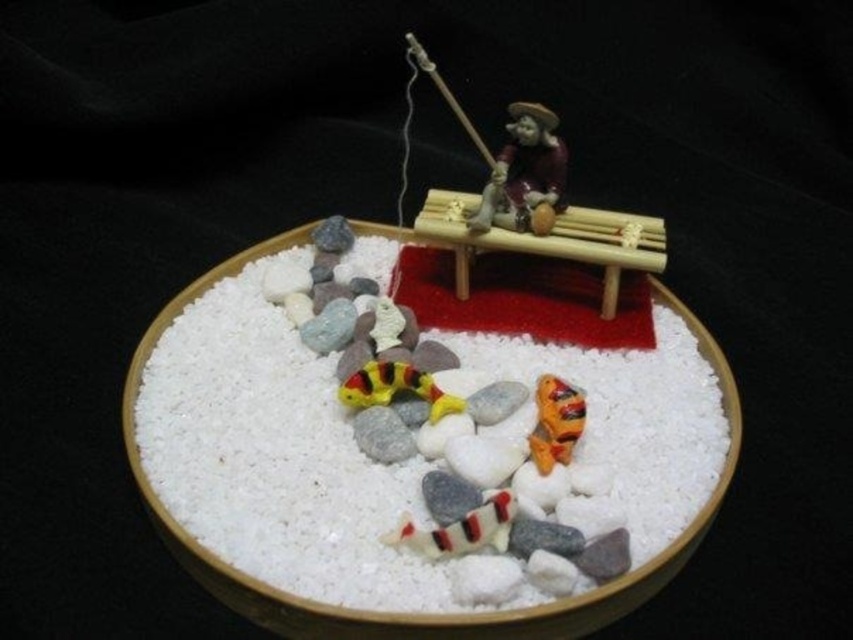
You are a tiny explorer standing at the edge of the circular container. You see the white sand at center located at point (267, 456). If you want to reach the white sand at center, which direction should you move from your current position?

Since the white sand at center is located at point (267, 456), you should move towards the center of the circular container to reach it.

You are an architect designing a scale model of a fishing village. In your model, you have a matte brown figurine at center. Where should you place it in the circular container to match the original diorama? Please provide coordinates.

The matte brown figurine at center should be placed at coordinates point [524,172] to match the original diorama.

You are a miniature model of a person standing on the white sand at center. You want to sit down on the matte brown figurine at center. Is the ground beneath the figurine stable enough for you to sit?

The white sand at center is below the matte brown figurine at center, so the ground beneath the figurine is made of sand. Since sand can shift or be unstable, it might not provide a solid base for sitting. It is advisable to avoid sitting directly on the figurine as the sand might not support your weight properly.